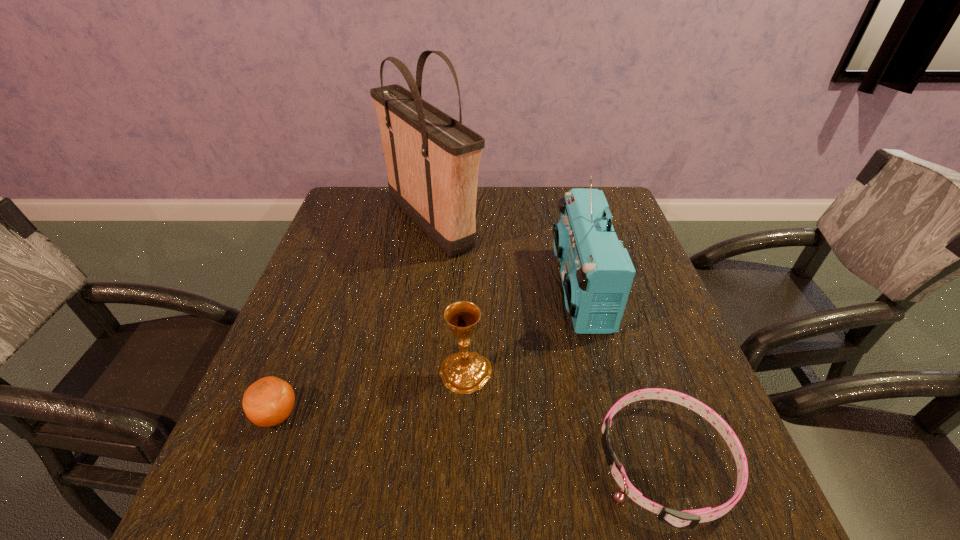
Locate an element on the screen. The height and width of the screenshot is (540, 960). vacant space located on the front-facing side of the fourth shortest object is located at coordinates (463, 288).

Locate an element on the screen. This screenshot has width=960, height=540. vacant space located on the right of the third farthest object is located at coordinates (661, 372).

Identify the location of free spot located 0.110m on the front of the leftmost object. (243, 502).

Find the location of a particular element. The image size is (960, 540). vacant space positioned with the buckle on the dog collar is located at coordinates (566, 462).

The image size is (960, 540). What are the coordinates of `vacant region located 0.340m with the buckle on the dog collar` in the screenshot? It's located at (400, 462).

Where is `vacant space located with the buckle on the dog collar`? The image size is (960, 540). vacant space located with the buckle on the dog collar is located at coordinates (406, 462).

Locate an element on the screen. object present at the far edge is located at coordinates (432, 160).

In order to click on object that is at the near edge in this screenshot , I will do `click(687, 519)`.

The image size is (960, 540). I want to click on shopping bag situated at the left edge, so click(432, 160).

This screenshot has width=960, height=540. I want to click on orange located in the left edge section of the desktop, so click(269, 401).